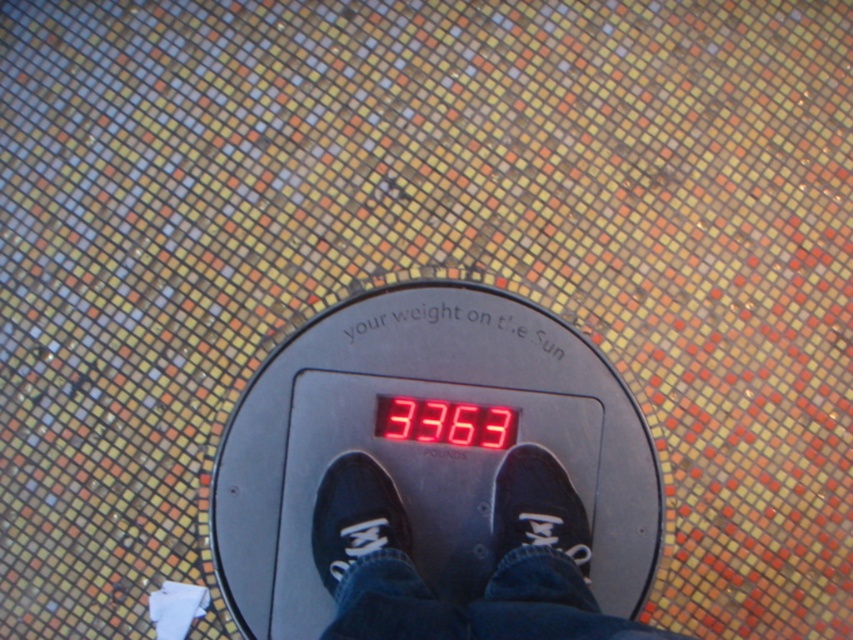
Question: Is black plastic scale at center below black canvas shoe at center?

Choices:
 (A) no
 (B) yes

Answer: (A)

Question: Does black plastic scale at center appear over black canvas shoe at center?

Choices:
 (A) no
 (B) yes

Answer: (B)

Question: Which point is farther from the camera taking this photo?

Choices:
 (A) (366, 483)
 (B) (521, 540)
 (C) (505, 467)
 (D) (610, 461)

Answer: (D)

Question: Is black plastic scale at center above black canvas shoes at center?

Choices:
 (A) yes
 (B) no

Answer: (A)

Question: Considering the real-world distances, which object is closest to the black canvas shoes at center?

Choices:
 (A) black canvas shoe at center
 (B) black plastic scale at center

Answer: (A)

Question: Which of the following is the closest to the observer?

Choices:
 (A) (462, 456)
 (B) (387, 477)
 (C) (320, 560)
 (D) (531, 488)

Answer: (C)